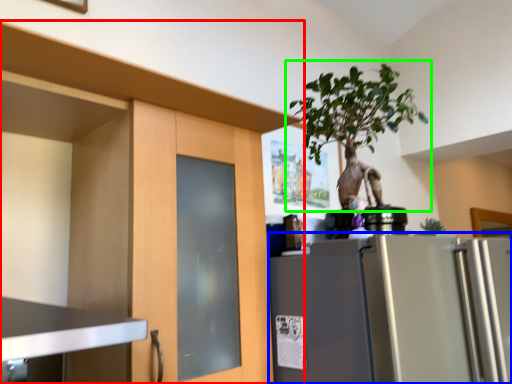
Question: Which object is positioned closest to cabinetry (highlighted by a red box)? Select from refrigerator (highlighted by a blue box) and houseplant (highlighted by a green box).

Choices:
 (A) refrigerator
 (B) houseplant

Answer: (A)